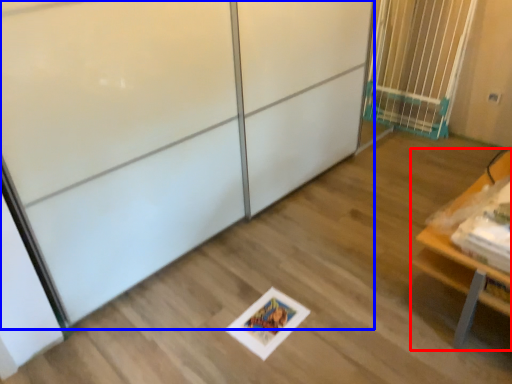
Question: Among these objects, which one is farthest to the camera, furniture (highlighted by a red box) or screen door (highlighted by a blue box)?

Choices:
 (A) furniture
 (B) screen door

Answer: (A)